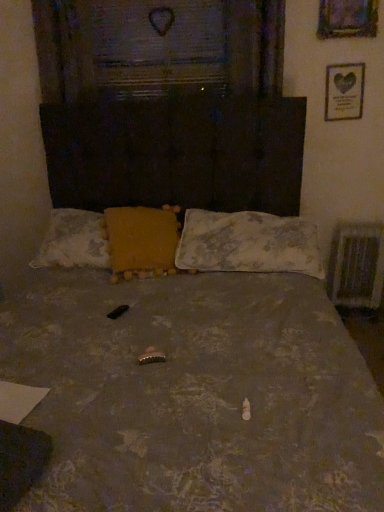
Question: Is wooden picture frame at upper right, which is the second picture frame from back to front, to the left or to the right of yellow fabric pillow at center, placed as the first pillow when sorted from left to right, in the image?

Choices:
 (A) right
 (B) left

Answer: (A)

Question: From the image's perspective, is wooden picture frame at upper right, acting as the 2th picture frame starting from the bottom, located above or below yellow fabric pillow at center, placed as the first pillow when sorted from left to right?

Choices:
 (A) below
 (B) above

Answer: (B)

Question: Considering the real-world distances, which object is farthest from the metallic silver radiator at right?

Choices:
 (A) wooden picture frame at upper right, which is the second picture frame from back to front
 (B) gold metallic picture frame at upper right, the second picture frame when ordered from top to bottom
 (C) fluffy white pillow at center, acting as the first pillow starting from the right
 (D) yellow fabric pillow at center, placed as the first pillow when sorted from left to right

Answer: (D)

Question: Which is farther from the fluffy white pillow at center, arranged as the 2th pillow when viewed from the left?

Choices:
 (A) gold metallic picture frame at upper right, arranged as the second picture frame when viewed from the front
 (B) metallic silver radiator at right
 (C) wooden picture frame at upper right, which ranks as the first picture frame in front-to-back order
 (D) yellow fabric pillow at center, placed as the first pillow when sorted from left to right

Answer: (C)